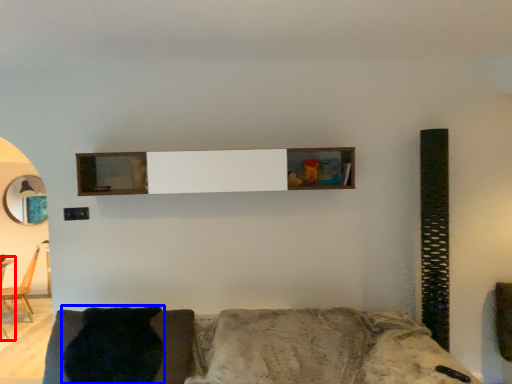
Question: Among these objects, which one is nearest to the camera, table (highlighted by a red box) or pillow (highlighted by a blue box)?

Choices:
 (A) table
 (B) pillow

Answer: (B)